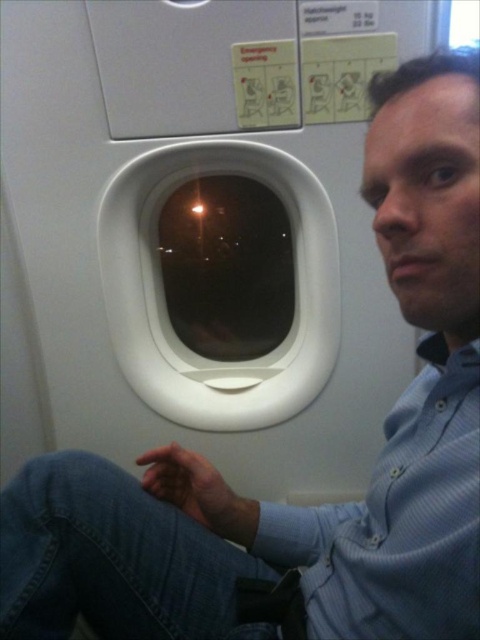
You are a flight attendant checking passengers for safety. You notice a passenger wearing a blue striped shirt at right and looking out the transparent glass airplane window at center. Which item is narrower in width?

The blue striped shirt at right is thinner than the transparent glass airplane window at center, so the blue striped shirt at right is narrower in width.

You are an airport security agent inspecting the image of a passenger in an airplane cabin. You notice the blue striped shirt at right. Based on its position, can you determine if the shirt is closer to the airplane window or the aisle?

The blue striped shirt at right is located at point 0.811 on the x and 0.846 on the y, which places it closer to the airplane window compared to the aisle.

You are a flight attendant checking passengers. You notice the blue striped shirt at right and the transparent glass airplane window at center. Which object is smaller in size?

The blue striped shirt at right is smaller in size compared to the transparent glass airplane window at center.